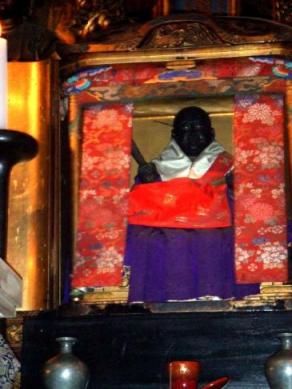
Identify the location of sash. This screenshot has width=292, height=389. point(218,171).